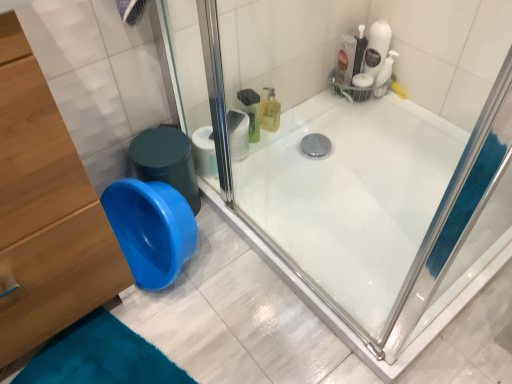
The width and height of the screenshot is (512, 384). What are the coordinates of `vacant region above blue plastic potty at lower left (from a real-world perspective)` in the screenshot? It's located at (154, 138).